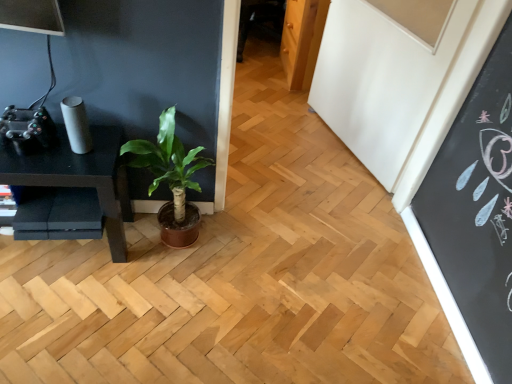
Locate an element on the screen. The image size is (512, 384). free space underneath green leafy plant at center (from a real-world perspective) is located at coordinates (168, 245).